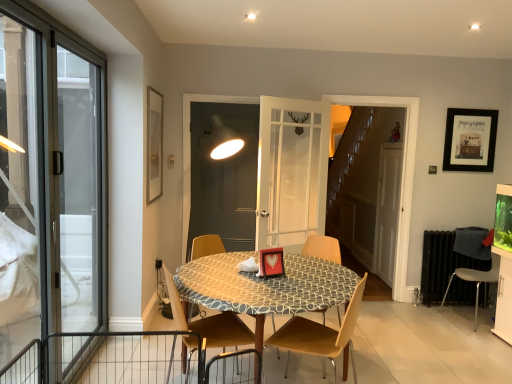
Question: From a real-world perspective, is matte gold picture frame at upper left, which appears as the first picture frame when viewed from the front, located higher than transparent glass door at left?

Choices:
 (A) yes
 (B) no

Answer: (A)

Question: Does matte gold picture frame at upper left, arranged as the first picture frame when viewed from the left, appear on the right side of transparent glass door at left?

Choices:
 (A) no
 (B) yes

Answer: (B)

Question: Can we say matte gold picture frame at upper left, which appears as the first picture frame when viewed from the front, lies outside transparent glass door at left?

Choices:
 (A) no
 (B) yes

Answer: (B)

Question: Is matte gold picture frame at upper left, which appears as the first picture frame when viewed from the front, placed right next to transparent glass door at left?

Choices:
 (A) no
 (B) yes

Answer: (A)

Question: Can you confirm if matte gold picture frame at upper left, which appears as the first picture frame when viewed from the front, is smaller than transparent glass door at left?

Choices:
 (A) yes
 (B) no

Answer: (A)

Question: In the image, is black metallic radiator at lower right positioned in front of or behind matte gray screen door at center, positioned as the first screen door in left-to-right order?

Choices:
 (A) front
 (B) behind

Answer: (B)

Question: Would you say black metallic radiator at lower right is to the left or to the right of matte gray screen door at center, positioned as the first screen door in left-to-right order, in the picture?

Choices:
 (A) left
 (B) right

Answer: (B)

Question: From the image's perspective, is black metallic radiator at lower right located above or below matte gray screen door at center, positioned as the first screen door in left-to-right order?

Choices:
 (A) below
 (B) above

Answer: (A)

Question: Is black metallic radiator at lower right taller or shorter than matte gray screen door at center, which ranks as the second screen door in back-to-front order?

Choices:
 (A) short
 (B) tall

Answer: (A)

Question: Looking at the image, does wooden chair at center, acting as the 4th chair starting from the right, seem bigger or smaller compared to matte gold picture frame at upper left, arranged as the first picture frame when viewed from the left?

Choices:
 (A) big
 (B) small

Answer: (A)

Question: From the image's perspective, is wooden chair at center, the 1th chair in the left-to-right sequence, above or below matte gold picture frame at upper left, arranged as the first picture frame when viewed from the left?

Choices:
 (A) below
 (B) above

Answer: (A)

Question: Is wooden chair at center, acting as the 4th chair starting from the right, in front of or behind matte gold picture frame at upper left, which appears as the second picture frame when viewed from the right, in the image?

Choices:
 (A) behind
 (B) front

Answer: (B)

Question: In terms of height, does wooden chair at center, the 1th chair in the left-to-right sequence, look taller or shorter compared to matte gold picture frame at upper left, positioned as the second picture frame in back-to-front order?

Choices:
 (A) tall
 (B) short

Answer: (B)

Question: In the image, is matte gold picture frame at upper left, positioned as the second picture frame in back-to-front order, positioned in front of or behind matte gray screen door at center, which is the 1th screen door from front to back?

Choices:
 (A) behind
 (B) front

Answer: (B)

Question: In terms of width, does matte gold picture frame at upper left, which appears as the second picture frame when viewed from the right, look wider or thinner when compared to matte gray screen door at center, which ranks as the second screen door in back-to-front order?

Choices:
 (A) thin
 (B) wide

Answer: (B)